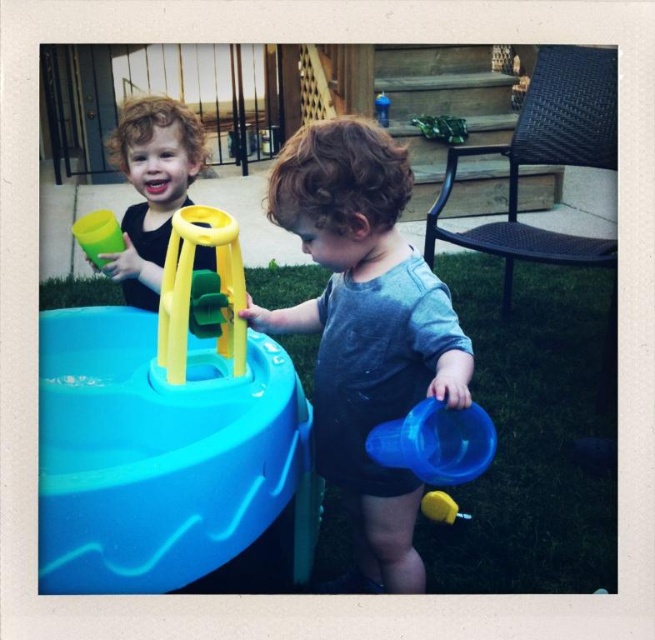
Question: Which point is farther to the camera?

Choices:
 (A) yellow rubber toy at lower center
 (B) green plastic cup at left
 (C) yellow plastic stool at center
 (D) matte plastic water table at center

Answer: (A)

Question: Which point appears closest to the camera in this image?

Choices:
 (A) (202, 218)
 (B) (183, 196)
 (C) (100, 269)
 (D) (86, 480)

Answer: (D)

Question: Can you confirm if gray matte shirt at center is positioned to the left of green plastic cup at left?

Choices:
 (A) no
 (B) yes

Answer: (A)

Question: Which point is farther from the camera taking this photo?

Choices:
 (A) (90, 241)
 (B) (138, 161)
 (C) (299, 540)

Answer: (B)

Question: Does matte plastic water table at center come behind blue plastic cup at lower center?

Choices:
 (A) no
 (B) yes

Answer: (B)

Question: Is matte plastic water table at center below yellow rubber toy at lower center?

Choices:
 (A) no
 (B) yes

Answer: (A)